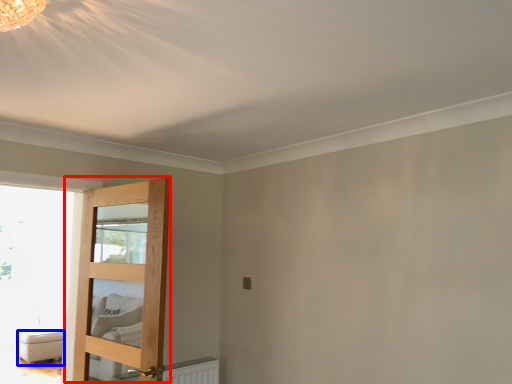
Question: Which point is further to the camera, door (highlighted by a red box) or furniture (highlighted by a blue box)?

Choices:
 (A) door
 (B) furniture

Answer: (B)